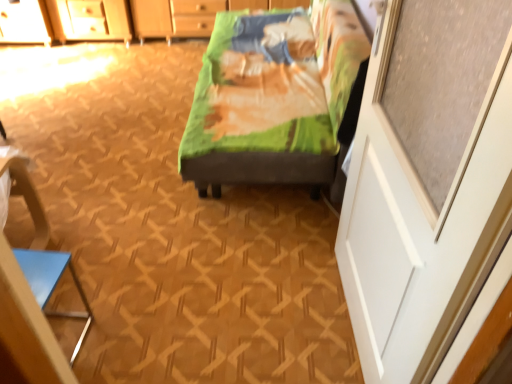
I want to click on vacant region below blue glossy triangle at lower left (from a real-world perspective), so click(67, 334).